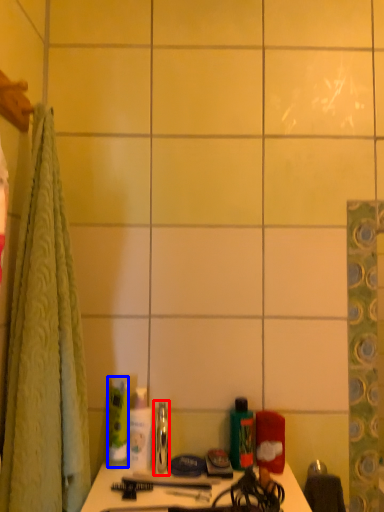
Question: Which object appears farthest to the camera in this image, mouthwash (highlighted by a red box) or toiletry (highlighted by a blue box)?

Choices:
 (A) mouthwash
 (B) toiletry

Answer: (B)